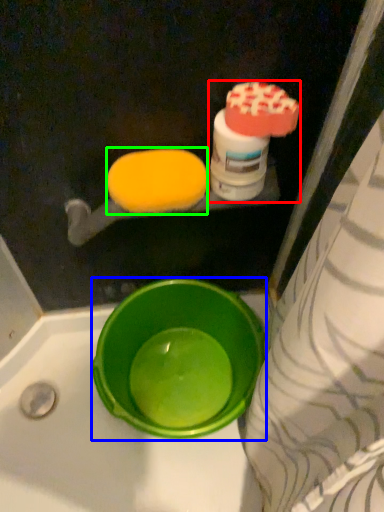
Question: Considering the real-world distances, which object is closest to cleaning product (highlighted by a red box)? basin (highlighted by a blue box) or food (highlighted by a green box).

Choices:
 (A) basin
 (B) food

Answer: (B)